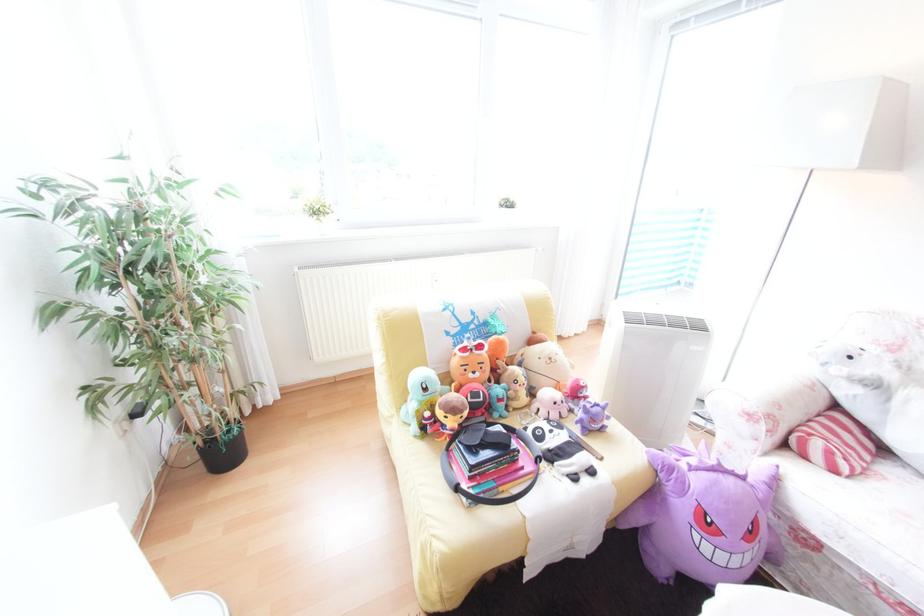
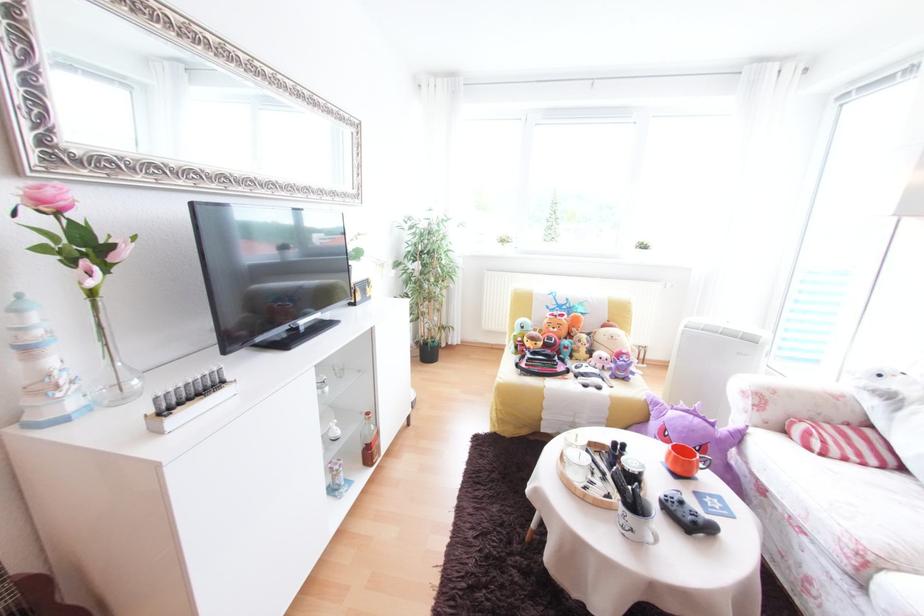
In the second image, find the point that corresponds to point 892,460 in the first image.

(907, 472)